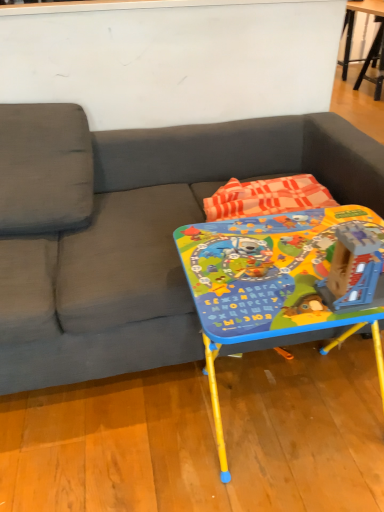
Question: Is the depth of plastic blue building at center greater than that of wooden table at upper right, placed as the first table when sorted from right to left?

Choices:
 (A) yes
 (B) no

Answer: (B)

Question: Is plastic blue building at center surrounding wooden table at upper right, the 1th table from the back?

Choices:
 (A) no
 (B) yes

Answer: (A)

Question: Does plastic blue building at center have a larger size compared to wooden table at upper right, the 1th table from the back?

Choices:
 (A) no
 (B) yes

Answer: (A)

Question: From a real-world perspective, is plastic blue building at center beneath wooden table at upper right, which ranks as the 2th table in left-to-right order?

Choices:
 (A) no
 (B) yes

Answer: (A)

Question: Is plastic blue building at center completely or partially outside of wooden table at upper right, which ranks as the 2th table in left-to-right order?

Choices:
 (A) yes
 (B) no

Answer: (A)

Question: Could you tell me if plastic blue building at center is turned towards wooden table at upper right, which appears as the 2th table when ordered from the bottom?

Choices:
 (A) yes
 (B) no

Answer: (B)

Question: Is matte plastic table at center, marked as the 2th table in a top-to-bottom arrangement, facing away from gray fabric couch at center?

Choices:
 (A) yes
 (B) no

Answer: (A)

Question: Does matte plastic table at center, which is the second table in back-to-front order, turn towards gray fabric couch at center?

Choices:
 (A) no
 (B) yes

Answer: (A)

Question: Is matte plastic table at center, arranged as the first table when ordered from the bottom, positioned beyond the bounds of gray fabric couch at center?

Choices:
 (A) yes
 (B) no

Answer: (A)

Question: From a real-world perspective, is matte plastic table at center, the first table in the front-to-back sequence, beneath gray fabric couch at center?

Choices:
 (A) yes
 (B) no

Answer: (A)

Question: Is matte plastic table at center, arranged as the first table when ordered from the bottom, in front of gray fabric couch at center?

Choices:
 (A) no
 (B) yes

Answer: (A)

Question: Considering the relative sizes of matte plastic table at center, which is the second table in back-to-front order, and gray fabric couch at center in the image provided, is matte plastic table at center, which is the second table in back-to-front order, shorter than gray fabric couch at center?

Choices:
 (A) yes
 (B) no

Answer: (A)

Question: Is plastic blue building at center thinner than matte plastic table at center, the first table in the front-to-back sequence?

Choices:
 (A) yes
 (B) no

Answer: (A)